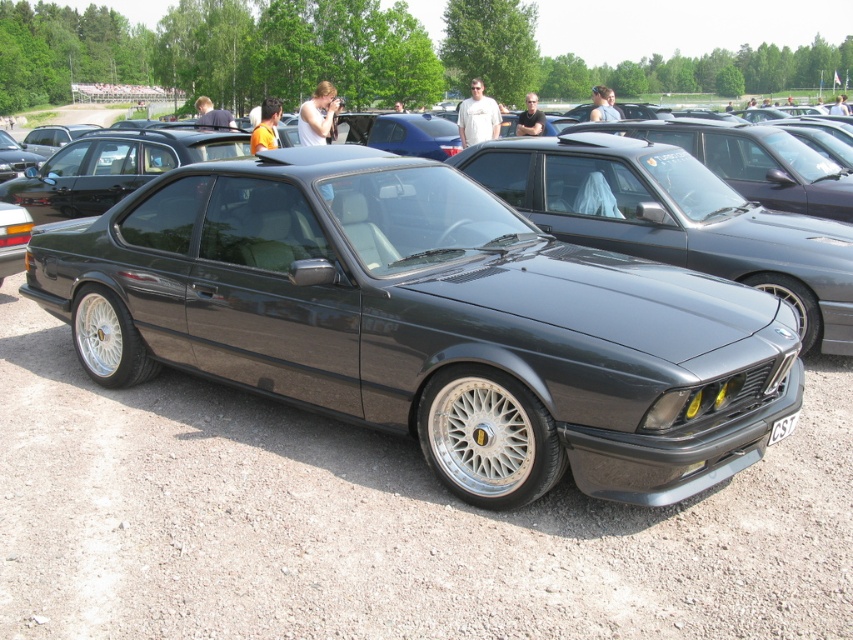
Based on the photo, you are at a car show and see two cars at the center of the image. The metallic gray car at center and the satin black car at center. Which one is positioned to the left?

The metallic gray car at center is positioned to the left of the satin black car at center.

You are a photographer at a car show and need to capture the entire satin black car at center without any obstructions. However, there is a black plastic license plate at center in the way. Based on their positions, can you adjust your camera angle to avoid the license plate while still framing the car?

The black plastic license plate at center is behind the satin black car at center, so you can position the camera to focus on the front or side of the satin black car at center, ensuring the license plate is out of frame or obscured by the car itself.